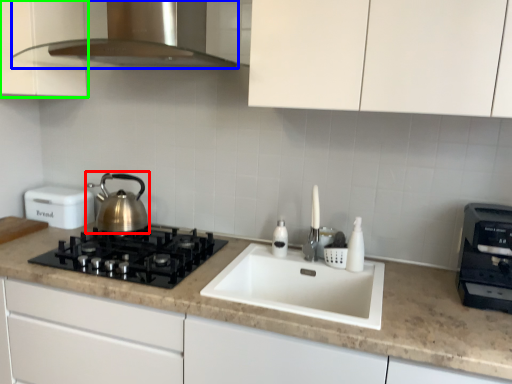
Question: Estimate the real-world distances between objects in this image. Which object is closer to kettle (highlighted by a red box), home appliance (highlighted by a blue box) or cabinetry (highlighted by a green box)?

Choices:
 (A) home appliance
 (B) cabinetry

Answer: (B)